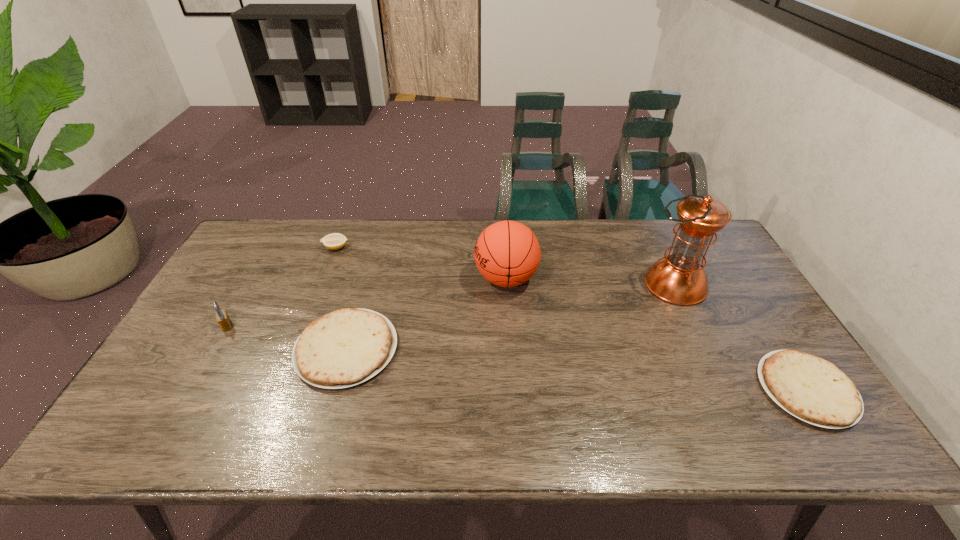
You are a GUI agent. You are given a task and a screenshot of the screen. Output one action in this format:
    pyautogui.click(x=<x>, y=<y>)
    Task: Click on the tortilla that is at the right edge
    
    Given the screenshot: What is the action you would take?
    pyautogui.click(x=814, y=390)

This screenshot has height=540, width=960. Identify the location of oil lamp that is at the right edge. click(679, 279).

This screenshot has height=540, width=960. In order to click on object present at the near right corner in this screenshot , I will do `click(814, 390)`.

What are the coordinates of `free region at the far edge of the desktop` in the screenshot? It's located at (399, 250).

The height and width of the screenshot is (540, 960). I want to click on free region at the near edge of the desktop, so click(604, 386).

You are a GUI agent. You are given a task and a screenshot of the screen. Output one action in this format:
    pyautogui.click(x=<x>, y=<y>)
    Task: Click on the vacant area at the left edge
    
    Given the screenshot: What is the action you would take?
    click(x=232, y=287)

Locate an element on the screen. The height and width of the screenshot is (540, 960). free space at the right edge is located at coordinates (767, 328).

Identify the location of free space at the far left corner of the desktop. The height and width of the screenshot is (540, 960). (238, 253).

The image size is (960, 540). Identify the location of empty location between the left tortilla and the padlock. (287, 337).

Image resolution: width=960 pixels, height=540 pixels. What are the coordinates of `unoccupied position between the third tallest object and the tallest object` in the screenshot? It's located at (450, 305).